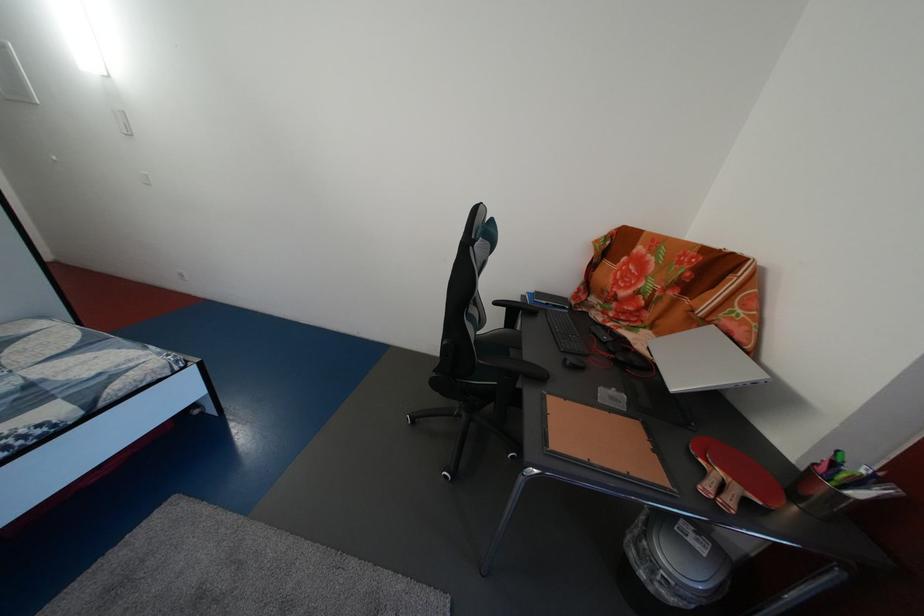
In order to click on pen holder cup in this screenshot , I will do `click(839, 485)`.